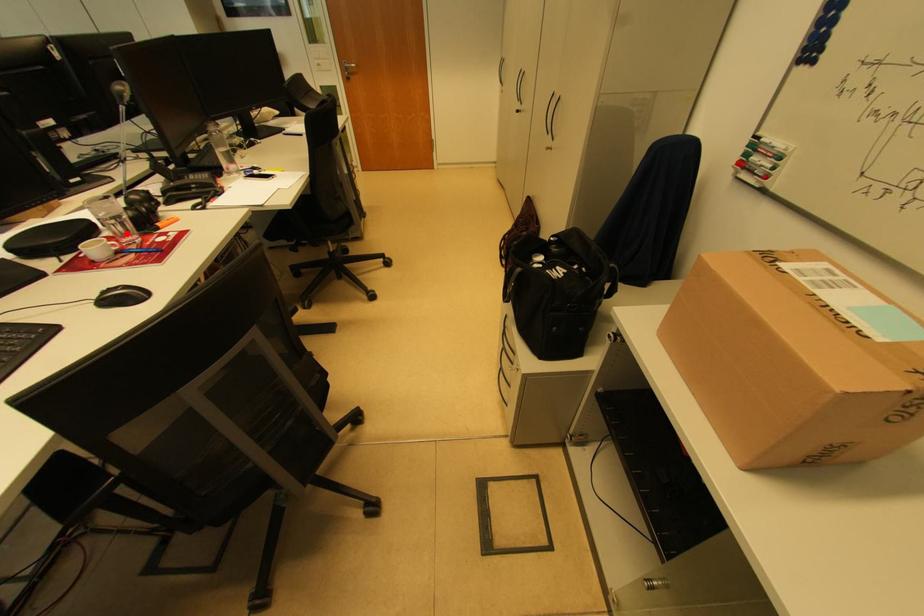
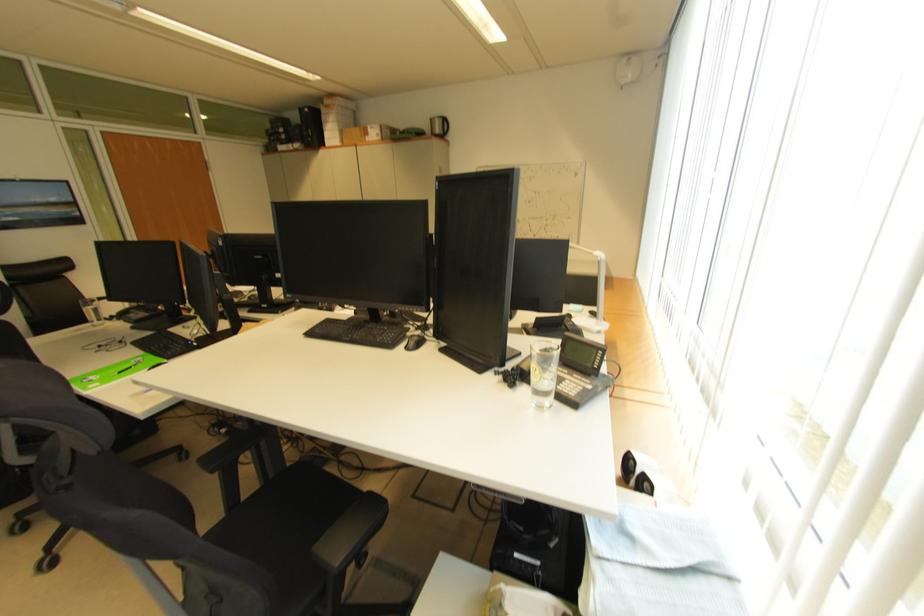
Question: I am providing you with two images of the same scene from different viewpoints. A red point is marked on the first image. At the location where the point appears in image 1, is it still visible in image 2?

Choices:
 (A) Yes
 (B) No

Answer: (B)